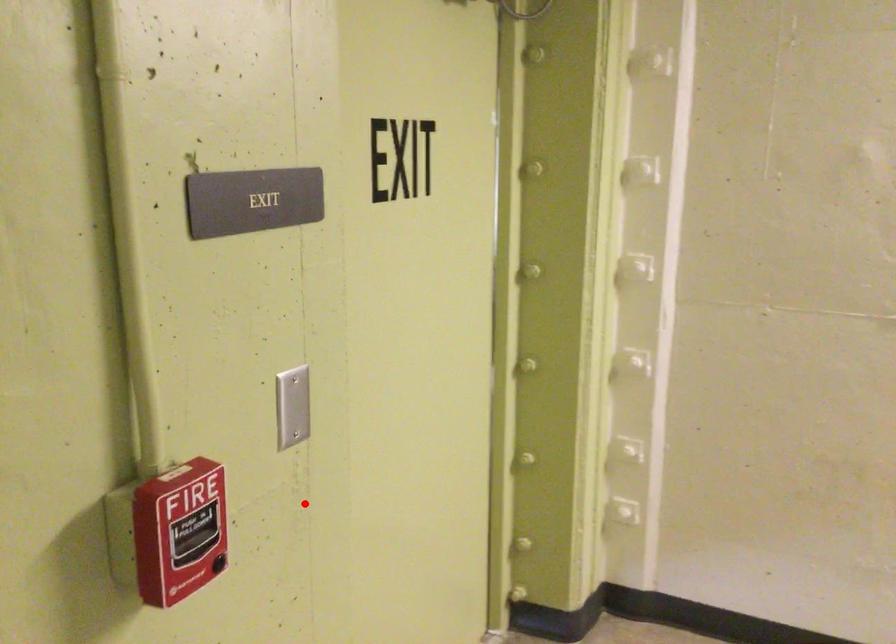
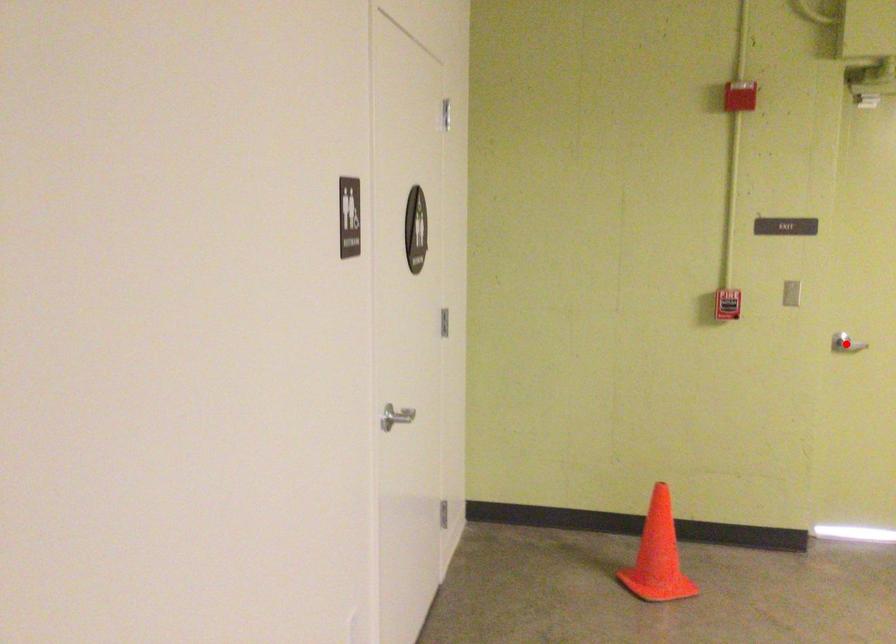
I am providing you with two images of the same scene from different viewpoints. A red point is marked on the first image and another point is marked on the second image. Is the red point in image1 aligned with the point shown in image2?

Yes